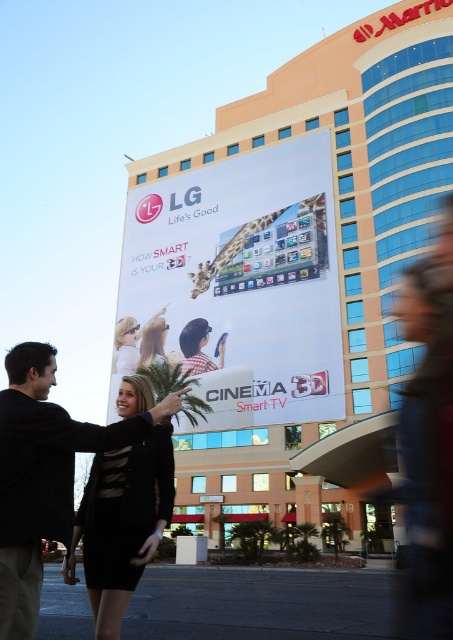
You are a photographer standing in front of the beige glass building at upper center and the matte black dress at center. You want to capture a photo where both objects are clearly visible. Which object should you focus on to ensure the other remains in the background?

You should focus on the beige glass building at upper center because it is larger in size compared to the matte black dress at center, ensuring the dress stays in the background while the building is in focus.